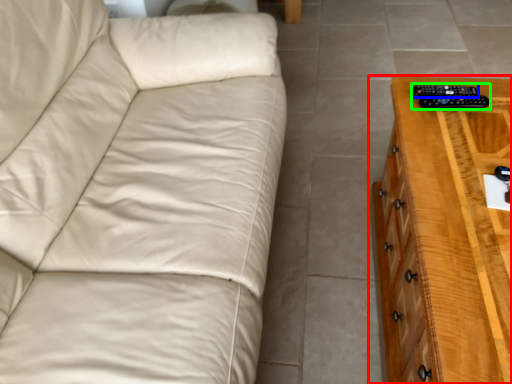
Question: Considering the real-world distances, which object is farthest from chest of drawers (highlighted by a red box)? remote (highlighted by a blue box) or control (highlighted by a green box)?

Choices:
 (A) remote
 (B) control

Answer: (A)